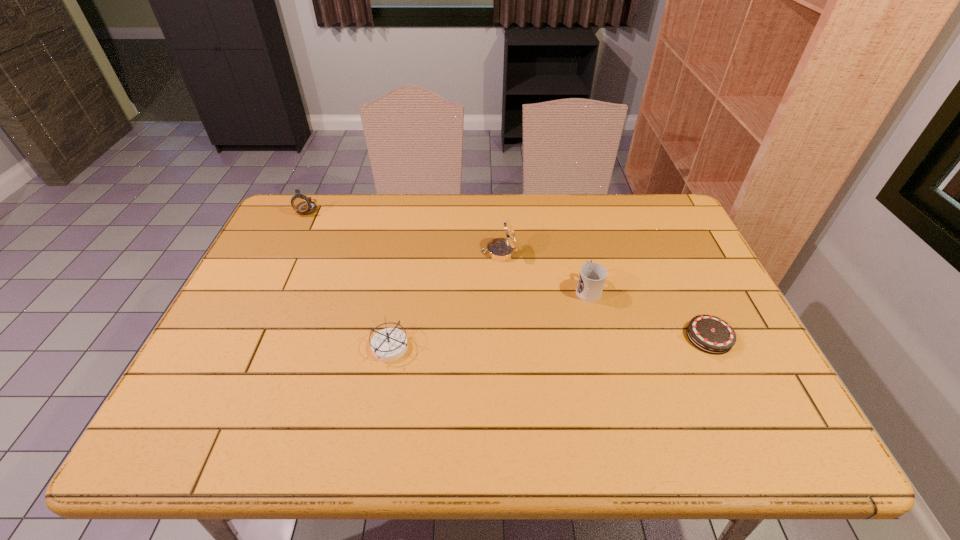
This screenshot has width=960, height=540. Find the location of `object present at the left edge`. object present at the left edge is located at coordinates (302, 204).

This screenshot has height=540, width=960. What are the coordinates of `object situated at the right edge` in the screenshot? It's located at (710, 334).

You are a GUI agent. You are given a task and a screenshot of the screen. Output one action in this format:
    pyautogui.click(x=<x>, y=<y>)
    Task: Click on the object present at the far left corner
    Image resolution: width=960 pixels, height=540 pixels.
    Given the screenshot: What is the action you would take?
    pyautogui.click(x=302, y=204)

The height and width of the screenshot is (540, 960). I want to click on free point at the far edge, so click(x=503, y=205).

You are a GUI agent. You are given a task and a screenshot of the screen. Output one action in this format:
    pyautogui.click(x=<x>, y=<y>)
    Task: Click on the vacant area at the near edge
    
    Given the screenshot: What is the action you would take?
    pyautogui.click(x=444, y=426)

Identify the location of vacant area at the left edge of the desktop. Image resolution: width=960 pixels, height=540 pixels. (269, 252).

This screenshot has width=960, height=540. In the image, there is a desktop. Find the location of `free space at the right edge`. free space at the right edge is located at coordinates (762, 411).

The height and width of the screenshot is (540, 960). In the image, there is a desktop. Find the location of `vacant space at the far left corner`. vacant space at the far left corner is located at coordinates (285, 209).

This screenshot has width=960, height=540. I want to click on vacant space at the near left corner, so click(x=204, y=430).

Where is `free region at the near right corner of the desktop`? The width and height of the screenshot is (960, 540). free region at the near right corner of the desktop is located at coordinates (790, 453).